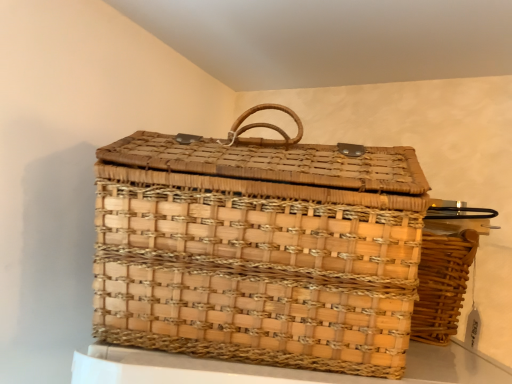
Question: Can you confirm if natural woven picnic basket at right, which appears as the 2th picnic basket when viewed from the left, is bigger than natural woven picnic basket at center, which appears as the 2th picnic basket when viewed from the right?

Choices:
 (A) no
 (B) yes

Answer: (A)

Question: Is the depth of natural woven picnic basket at right, which appears as the 2th picnic basket when viewed from the left, less than that of natural woven picnic basket at center, which appears as the 2th picnic basket when viewed from the right?

Choices:
 (A) no
 (B) yes

Answer: (A)

Question: Is natural woven picnic basket at right, which appears as the 2th picnic basket when viewed from the left, facing towards natural woven picnic basket at center, which appears as the 2th picnic basket when viewed from the right?

Choices:
 (A) no
 (B) yes

Answer: (A)

Question: Considering the relative positions of natural woven picnic basket at right, which appears as the 2th picnic basket when viewed from the left, and natural woven picnic basket at center, which ranks as the 1th picnic basket in left-to-right order, in the image provided, is natural woven picnic basket at right, which appears as the 2th picnic basket when viewed from the left, to the right of natural woven picnic basket at center, which ranks as the 1th picnic basket in left-to-right order, from the viewer's perspective?

Choices:
 (A) yes
 (B) no

Answer: (A)

Question: From the image's perspective, does natural woven picnic basket at right, which appears as the 2th picnic basket when viewed from the left, appear lower than natural woven picnic basket at center, which ranks as the 1th picnic basket in left-to-right order?

Choices:
 (A) no
 (B) yes

Answer: (B)

Question: Is natural woven picnic basket at right, which appears as the 2th picnic basket when viewed from the left, positioned with its back to natural woven picnic basket at center, which appears as the 2th picnic basket when viewed from the right?

Choices:
 (A) no
 (B) yes

Answer: (A)

Question: From a real-world perspective, is natural woven picnic basket at center, which appears as the 2th picnic basket when viewed from the right, on natural woven picnic basket at right, acting as the 1th picnic basket starting from the right?

Choices:
 (A) yes
 (B) no

Answer: (A)

Question: Is natural woven picnic basket at center, which ranks as the 1th picnic basket in left-to-right order, taller than natural woven picnic basket at right, which appears as the 2th picnic basket when viewed from the left?

Choices:
 (A) no
 (B) yes

Answer: (B)

Question: Is natural woven picnic basket at center, which appears as the 2th picnic basket when viewed from the right, behind natural woven picnic basket at right, which appears as the 2th picnic basket when viewed from the left?

Choices:
 (A) yes
 (B) no

Answer: (B)

Question: Is natural woven picnic basket at center, which appears as the 2th picnic basket when viewed from the right, with natural woven picnic basket at right, which appears as the 2th picnic basket when viewed from the left?

Choices:
 (A) yes
 (B) no

Answer: (B)

Question: Is natural woven picnic basket at center, which appears as the 2th picnic basket when viewed from the right, in front of natural woven picnic basket at right, which appears as the 2th picnic basket when viewed from the left?

Choices:
 (A) yes
 (B) no

Answer: (A)

Question: Considering the relative sizes of natural woven picnic basket at center, which ranks as the 1th picnic basket in left-to-right order, and natural woven picnic basket at right, which appears as the 2th picnic basket when viewed from the left, in the image provided, is natural woven picnic basket at center, which ranks as the 1th picnic basket in left-to-right order, bigger than natural woven picnic basket at right, which appears as the 2th picnic basket when viewed from the left,?

Choices:
 (A) yes
 (B) no

Answer: (A)

Question: Considering the positions of point (462, 297) and point (201, 203), is point (462, 297) closer or farther from the camera than point (201, 203)?

Choices:
 (A) farther
 (B) closer

Answer: (A)